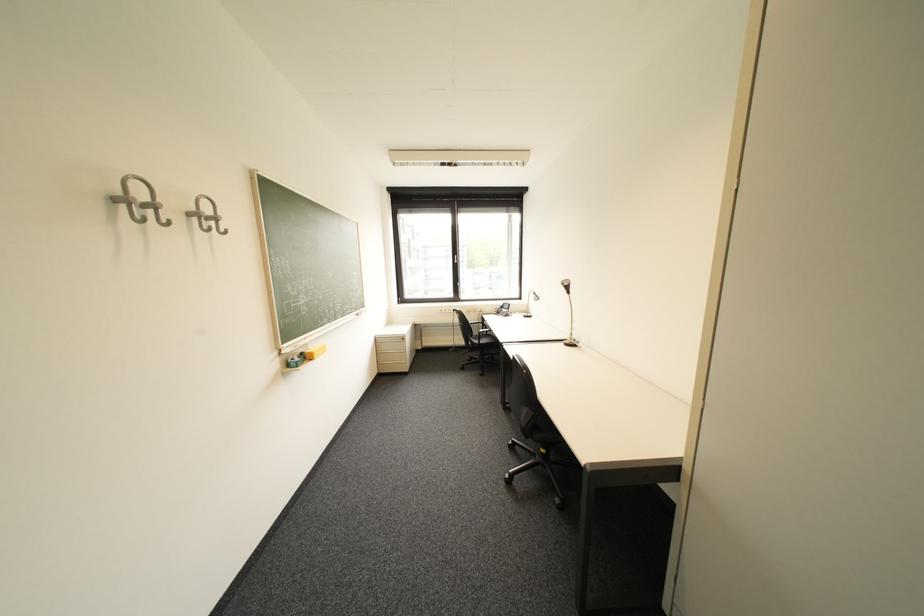
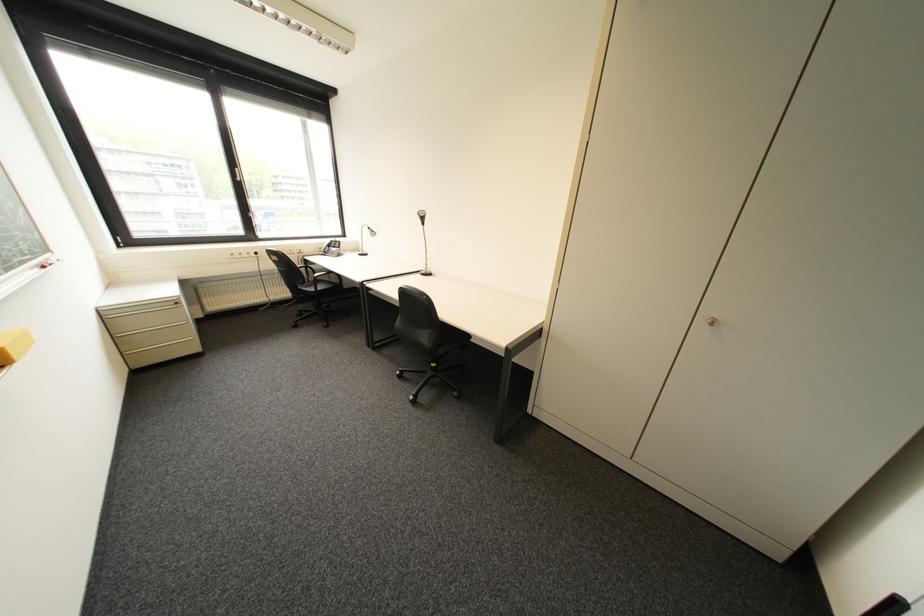
Question: The first image is from the beginning of the video and the second image is from the end. How did the camera likely rotate when shooting the video?

Choices:
 (A) Left
 (B) Right
 (C) Up
 (D) Down

Answer: (B)